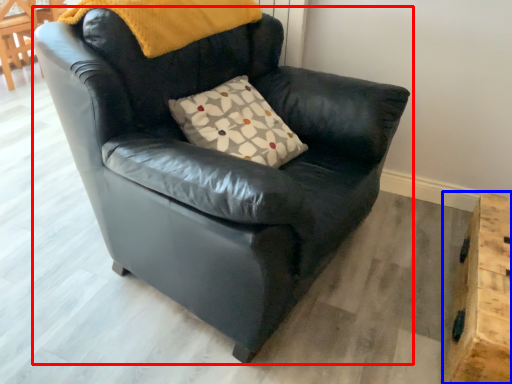
Question: Which of the following is the farthest to the observer, chair (highlighted by a red box) or table (highlighted by a blue box)?

Choices:
 (A) chair
 (B) table

Answer: (B)